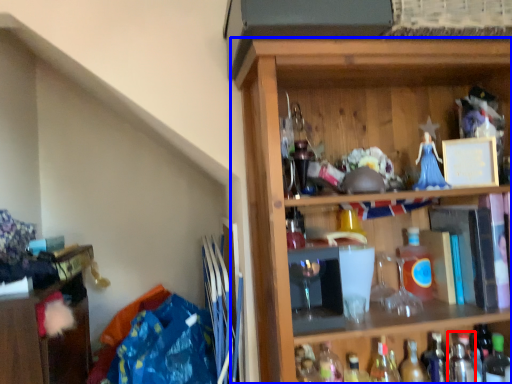
Question: Which of the following is the farthest to the observer, bottle (highlighted by a red box) or shelf (highlighted by a blue box)?

Choices:
 (A) bottle
 (B) shelf

Answer: (A)